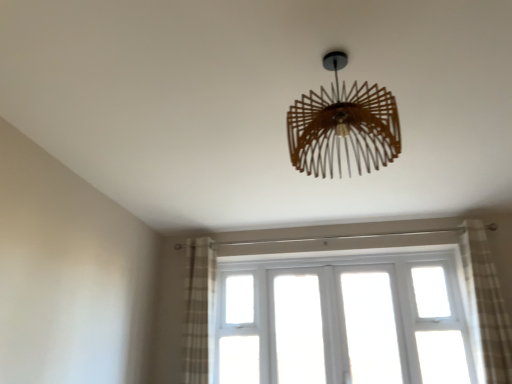
Question: Can you see wooden chandelier at center touching plaid fabric curtain at right, the 1th curtain viewed from the right?

Choices:
 (A) yes
 (B) no

Answer: (B)

Question: From the image's perspective, would you say wooden chandelier at center is positioned over plaid fabric curtain at right, the 2th curtain when ordered from left to right?

Choices:
 (A) no
 (B) yes

Answer: (B)

Question: Would you say wooden chandelier at center is outside plaid fabric curtain at right, the 1th curtain viewed from the right?

Choices:
 (A) no
 (B) yes

Answer: (B)

Question: Does wooden chandelier at center appear on the right side of plaid fabric curtain at right, the 2th curtain when ordered from left to right?

Choices:
 (A) yes
 (B) no

Answer: (B)

Question: Is wooden chandelier at center bigger than plaid fabric curtain at right, the 1th curtain viewed from the right?

Choices:
 (A) yes
 (B) no

Answer: (B)

Question: Looking at their shapes, would you say plaid fabric curtain at left, which is counted as the 2th curtain, starting from the right, is wider or thinner than plaid fabric curtain at right, the 2th curtain when ordered from left to right?

Choices:
 (A) wide
 (B) thin

Answer: (A)

Question: Is plaid fabric curtain at left, which is counted as the 2th curtain, starting from the right, situated inside plaid fabric curtain at right, the 2th curtain when ordered from left to right, or outside?

Choices:
 (A) inside
 (B) outside

Answer: (B)

Question: Relative to plaid fabric curtain at right, the 1th curtain viewed from the right, is plaid fabric curtain at left, which is counted as the 2th curtain, starting from the right, in front or behind?

Choices:
 (A) behind
 (B) front

Answer: (A)

Question: Visually, is plaid fabric curtain at left, which is counted as the 2th curtain, starting from the right, positioned to the left or to the right of plaid fabric curtain at right, the 1th curtain viewed from the right?

Choices:
 (A) right
 (B) left

Answer: (B)

Question: Based on their positions, is plaid fabric curtain at left, which is counted as the 2th curtain, starting from the right, located to the left or right of white wooden window at center?

Choices:
 (A) right
 (B) left

Answer: (B)

Question: Would you say plaid fabric curtain at left, arranged as the 1th curtain when viewed from the left, is inside or outside white wooden window at center?

Choices:
 (A) inside
 (B) outside

Answer: (B)

Question: Is point (188, 273) positioned closer to the camera than point (474, 306)?

Choices:
 (A) farther
 (B) closer

Answer: (A)

Question: Is plaid fabric curtain at left, which is counted as the 2th curtain, starting from the right, wider or thinner than white wooden window at center?

Choices:
 (A) thin
 (B) wide

Answer: (B)

Question: In the image, is wooden chandelier at center on the left side or the right side of plaid fabric curtain at right, the 1th curtain viewed from the right?

Choices:
 (A) right
 (B) left

Answer: (B)

Question: From the image's perspective, is wooden chandelier at center located above or below plaid fabric curtain at right, the 1th curtain viewed from the right?

Choices:
 (A) below
 (B) above

Answer: (B)